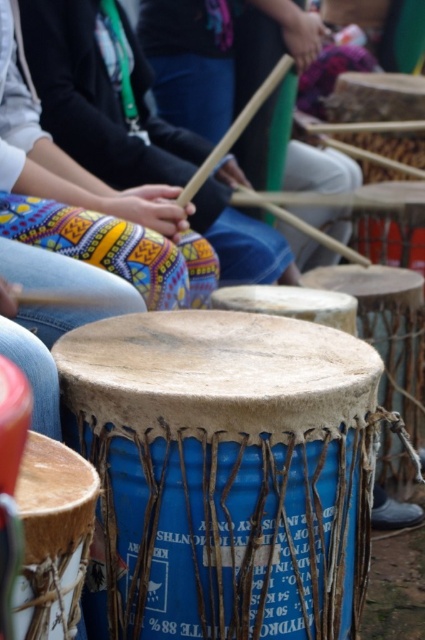
You are a drummer participating in a cultural event and you see the blue textured drum at center and the natural wood drum at center. Which drum is positioned to the right side of the other?

The blue textured drum at center is to the right of the natural wood drum at center.

You are a performer preparing to set up your equipment. You have a microphone stand that is 4 feet wide. Can you place it between the blue fabric drum at center and the blue textured drum at center without them touching?

The distance between the blue fabric drum at center and the blue textured drum at center is 4.76 feet. Since the microphone stand is 4 feet wide, there is enough space to place it between them without the drums touching.